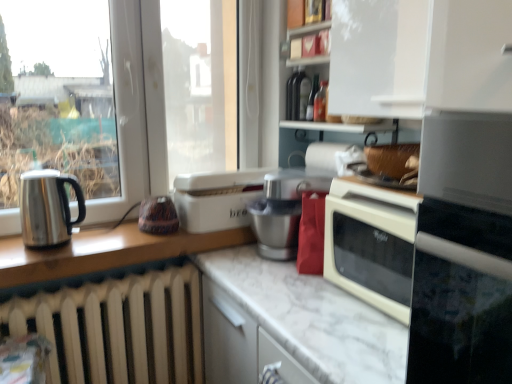
The image size is (512, 384). Describe the element at coordinates (217, 198) in the screenshot. I see `white plastic bread bin at center, the 2th kitchen appliance when ordered from left to right` at that location.

Locate an element on the screen. The width and height of the screenshot is (512, 384). white matte cabinet at upper right is located at coordinates (420, 57).

Measure the distance between point (x=413, y=106) and camera.

A distance of 1.00 meters exists between point (x=413, y=106) and camera.

Based on the photo, in order to face white marble countertop at center, should I rotate leftwards or rightwards?

Rotate your view right by about 10.076°.

Find the location of a particular element. This screenshot has height=384, width=512. stainless steel kettle at left, marked as the 1th kitchen appliance in a left-to-right arrangement is located at coordinates (48, 207).

From a real-world perspective, is white matte cabinet at upper right above or below white plastic bread bin at center, the 2th kitchen appliance when ordered from left to right?

In terms of real-world spatial position, white matte cabinet at upper right is above white plastic bread bin at center, the 2th kitchen appliance when ordered from left to right.

What's the angular difference between white matte cabinet at upper right and white plastic bread bin at center, which is the 1th kitchen appliance from back to front,'s facing directions?

There is a 1.61-degree angle between the facing directions of white matte cabinet at upper right and white plastic bread bin at center, which is the 1th kitchen appliance from back to front.

From the image's perspective, does white matte cabinet at upper right appear lower than white plastic bread bin at center, acting as the 2th kitchen appliance starting from the front?

No, from the image's perspective, white matte cabinet at upper right is not beneath white plastic bread bin at center, acting as the 2th kitchen appliance starting from the front.

Looking at their sizes, would you say white matte cabinet at upper right is wider or thinner than white plastic bread bin at center, acting as the 2th kitchen appliance starting from the front?

In the image, white matte cabinet at upper right appears to be more narrow than white plastic bread bin at center, acting as the 2th kitchen appliance starting from the front.

Based on the photo, from a real-world perspective, is white plastic bread bin at center, which is the 1th kitchen appliance from back to front, over metallic silver food processor at center?

Yes, from a real-world perspective, white plastic bread bin at center, which is the 1th kitchen appliance from back to front, is on top of metallic silver food processor at center.

From the image's perspective, is white plastic bread bin at center, marked as the first kitchen appliance in a right-to-left arrangement, below metallic silver food processor at center?

Actually, white plastic bread bin at center, marked as the first kitchen appliance in a right-to-left arrangement, appears above metallic silver food processor at center in the image.

Considering the relative positions of white plastic bread bin at center, acting as the 2th kitchen appliance starting from the front, and metallic silver food processor at center in the image provided, is white plastic bread bin at center, acting as the 2th kitchen appliance starting from the front, to the right of metallic silver food processor at center from the viewer's perspective?

No.

Considering the relative sizes of white plastic bread bin at center, acting as the 2th kitchen appliance starting from the front, and metallic silver food processor at center in the image provided, is white plastic bread bin at center, acting as the 2th kitchen appliance starting from the front, wider than metallic silver food processor at center?

Yes, white plastic bread bin at center, acting as the 2th kitchen appliance starting from the front, is wider than metallic silver food processor at center.

Based on the photo, considering the relative positions of stainless steel kettle at left, the first kitchen appliance from the front, and white matte cabinet at upper right in the image provided, is stainless steel kettle at left, the first kitchen appliance from the front, to the left of white matte cabinet at upper right from the viewer's perspective?

Indeed, stainless steel kettle at left, the first kitchen appliance from the front, is positioned on the left side of white matte cabinet at upper right.

Looking at this image, which of these two, stainless steel kettle at left, which is the second kitchen appliance in right-to-left order, or white matte cabinet at upper right, is wider?

With larger width is white matte cabinet at upper right.

Can you confirm if stainless steel kettle at left, which ranks as the second kitchen appliance in back-to-front order, is taller than white matte cabinet at upper right?

Incorrect, the height of stainless steel kettle at left, which ranks as the second kitchen appliance in back-to-front order, is not larger of that of white matte cabinet at upper right.

Is stainless steel kettle at left, which is the second kitchen appliance in right-to-left order, closer to camera compared to white matte cabinet at upper right?

No, stainless steel kettle at left, which is the second kitchen appliance in right-to-left order, is further to the viewer.

Between white marble countertop at center and white plastic bread bin at center, acting as the 2th kitchen appliance starting from the front, which one is positioned behind?

white plastic bread bin at center, acting as the 2th kitchen appliance starting from the front.

Is white marble countertop at center situated inside white plastic bread bin at center, marked as the first kitchen appliance in a right-to-left arrangement, or outside?

The correct answer is: outside.

Looking at the image, does white marble countertop at center seem bigger or smaller compared to white plastic bread bin at center, acting as the 2th kitchen appliance starting from the front?

white marble countertop at center is bigger than white plastic bread bin at center, acting as the 2th kitchen appliance starting from the front.

Is white marble countertop at center at the back of white matte cabinet at upper right?

No, white matte cabinet at upper right is not facing the opposite direction of white marble countertop at center.

Can we say white matte cabinet at upper right lies outside white marble countertop at center?

Indeed, white matte cabinet at upper right is completely outside white marble countertop at center.

Find the location of a particular element. cabinetry that appears behind the white marble countertop at center is located at coordinates (420, 57).

From a real-world perspective, is white matte cabinet at upper right over white marble countertop at center?

Correct, in the physical world, white matte cabinet at upper right is higher than white marble countertop at center.

Is white glossy shelf at upper center further to the viewer compared to white marble countertop at center?

That is True.

Does point (334, 51) lie in front of point (358, 315)?

No, (334, 51) is behind (358, 315).

From the image's perspective, between white glossy shelf at upper center and white marble countertop at center, which one is located above?

From the image's view, white glossy shelf at upper center is above.

Is white glossy shelf at upper center with white marble countertop at center?

No, white glossy shelf at upper center is not making contact with white marble countertop at center.

Considering the positions of objects stainless steel kettle at left, which is the second kitchen appliance in right-to-left order, and metallic silver food processor at center in the image provided, who is more to the right, stainless steel kettle at left, which is the second kitchen appliance in right-to-left order, or metallic silver food processor at center?

metallic silver food processor at center.

At what (x,y) coordinates should I click in order to perform the action: click on the 2nd kitchen appliance positioned above the metallic silver food processor at center (from a real-world perspective). Please return your answer as a coordinate pair (x, y). This screenshot has width=512, height=384. Looking at the image, I should click on (48, 207).

Does point (36, 194) come farther from viewer compared to point (255, 220)?

No, (36, 194) is in front of (255, 220).

From a real-world perspective, is stainless steel kettle at left, which ranks as the second kitchen appliance in back-to-front order, positioned above or below metallic silver food processor at center?

Clearly, from a real-world perspective, stainless steel kettle at left, which ranks as the second kitchen appliance in back-to-front order, is above metallic silver food processor at center.

The image size is (512, 384). In order to click on cabinetry above the white plastic bread bin at center, the 2th kitchen appliance when ordered from left to right (from the image's perspective) in this screenshot , I will do `click(420, 57)`.

I want to click on kitchen appliance that is the 1st object to the left of the metallic silver food processor at center, starting at the anchor, so click(217, 198).

From the image, which object appears to be nearer to white matte cabinet at upper right, stainless steel kettle at left, the first kitchen appliance from the front, or white marble countertop at center?

white marble countertop at center is positioned closer to the anchor white matte cabinet at upper right.

Considering their positions, is white marble countertop at center positioned further to metallic silver food processor at center than white glossy shelf at upper center?

white glossy shelf at upper center.

Looking at the image, which one is located further to white plastic bread bin at center, which is the 1th kitchen appliance from back to front, white marble countertop at center or white matte cabinet at upper right?

white matte cabinet at upper right lies further to white plastic bread bin at center, which is the 1th kitchen appliance from back to front, than the other object.

Which object lies further to the anchor point stainless steel kettle at left, which is the second kitchen appliance in right-to-left order, white matte cabinet at upper right or metallic silver food processor at center?

white matte cabinet at upper right.

Looking at the image, which one is located closer to stainless steel kettle at left, the first kitchen appliance from the front, white marble countertop at center or white glossy shelf at upper center?

Among the two, white marble countertop at center is located nearer to stainless steel kettle at left, the first kitchen appliance from the front.

Which object lies nearer to the anchor point metallic silver food processor at center, white plastic bread bin at center, which is the 1th kitchen appliance from back to front, or stainless steel kettle at left, which is the second kitchen appliance in right-to-left order?

The object closer to metallic silver food processor at center is white plastic bread bin at center, which is the 1th kitchen appliance from back to front.

When comparing their distances from white glossy shelf at upper center, does white marble countertop at center or white matte cabinet at upper right seem further?

white marble countertop at center is further to white glossy shelf at upper center.

Estimate the real-world distances between objects in this image. Which object is closer to metallic silver food processor at center, white matte cabinet at upper right or white marble countertop at center?

white marble countertop at center.

Identify the location of kitchen appliance located between stainless steel kettle at left, which ranks as the second kitchen appliance in back-to-front order, and white glossy shelf at upper center in the left-right direction. This screenshot has height=384, width=512. (217, 198).

This screenshot has height=384, width=512. Find the location of `appliance between white marble countertop at center and white plastic bread bin at center, which is the 1th kitchen appliance from back to front, in the front-back direction`. appliance between white marble countertop at center and white plastic bread bin at center, which is the 1th kitchen appliance from back to front, in the front-back direction is located at coordinates (284, 209).

The height and width of the screenshot is (384, 512). Find the location of `appliance between white glossy shelf at upper center and white marble countertop at center from top to bottom`. appliance between white glossy shelf at upper center and white marble countertop at center from top to bottom is located at coordinates (284, 209).

Image resolution: width=512 pixels, height=384 pixels. I want to click on appliance between white matte cabinet at upper right and white marble countertop at center in the vertical direction, so click(284, 209).